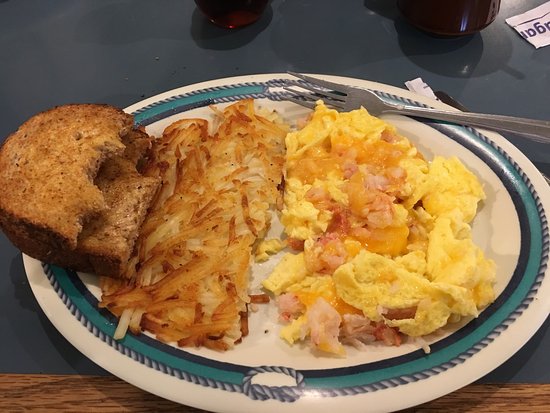
Identify the location of fork. This screenshot has height=413, width=550. coord(376,104).